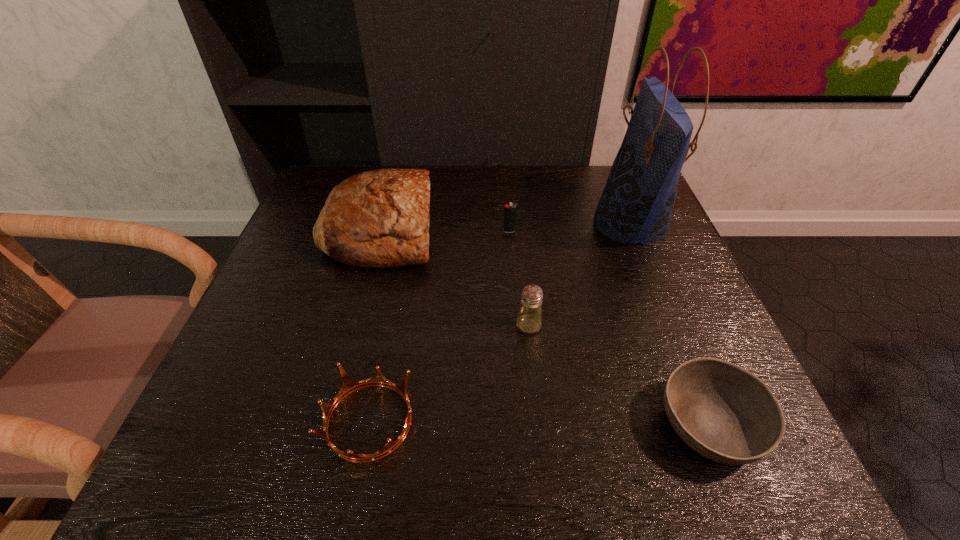
The height and width of the screenshot is (540, 960). In order to click on object positioned at the far left corner in this screenshot , I will do `click(380, 218)`.

Where is `object situated at the far right corner`? object situated at the far right corner is located at coordinates (637, 202).

At what (x,y) coordinates should I click in order to perform the action: click on object located at the near right corner. Please return your answer as a coordinate pair (x, y). This screenshot has width=960, height=540. Looking at the image, I should click on (723, 412).

Identify the location of vacant space at the far edge of the desktop. (552, 191).

In the image, there is a desktop. In order to click on free region at the near edge in this screenshot , I will do `click(524, 469)`.

The height and width of the screenshot is (540, 960). Identify the location of vacant space at the left edge of the desktop. (328, 300).

In the image, there is a desktop. Identify the location of free space at the right edge. Image resolution: width=960 pixels, height=540 pixels. (637, 265).

In the image, there is a desktop. At what (x,y) coordinates should I click in order to perform the action: click on free space at the far left corner. Please return your answer as a coordinate pair (x, y). The image size is (960, 540). Looking at the image, I should click on (314, 205).

This screenshot has width=960, height=540. Find the location of `unoccupied position between the bowl and the third nearest object`. unoccupied position between the bowl and the third nearest object is located at coordinates (619, 375).

Image resolution: width=960 pixels, height=540 pixels. I want to click on free space between the tallest object and the third nearest object, so click(580, 275).